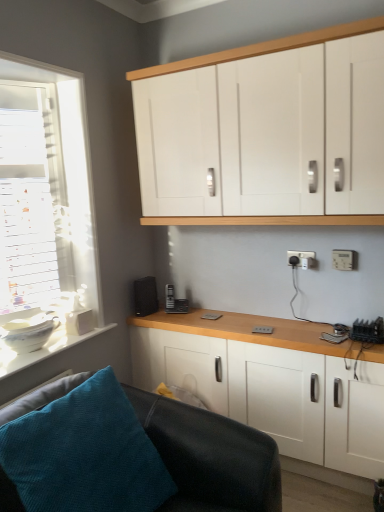
Question: Can you confirm if white glossy bowl at lower left is thinner than white matte cabinet at upper center, arranged as the 2th cabinetry when ordered from the bottom?

Choices:
 (A) yes
 (B) no

Answer: (B)

Question: Is white glossy bowl at lower left shorter than white matte cabinet at upper center, marked as the 1th cabinetry in a top-to-bottom arrangement?

Choices:
 (A) yes
 (B) no

Answer: (A)

Question: Considering the relative positions of white glossy bowl at lower left and white matte cabinet at upper center, marked as the 1th cabinetry in a top-to-bottom arrangement, in the image provided, is white glossy bowl at lower left to the left of white matte cabinet at upper center, marked as the 1th cabinetry in a top-to-bottom arrangement, from the viewer's perspective?

Choices:
 (A) no
 (B) yes

Answer: (B)

Question: From a real-world perspective, is white glossy bowl at lower left positioned over white matte cabinet at upper center, arranged as the 2th cabinetry when ordered from the bottom, based on gravity?

Choices:
 (A) no
 (B) yes

Answer: (A)

Question: Does white glossy bowl at lower left come behind white matte cabinet at upper center, marked as the 1th cabinetry in a top-to-bottom arrangement?

Choices:
 (A) yes
 (B) no

Answer: (A)

Question: Is white glossy bowl at lower left facing towards white matte cabinet at upper center, arranged as the 2th cabinetry when ordered from the bottom?

Choices:
 (A) yes
 (B) no

Answer: (B)

Question: Is the depth of white matte cabinet at lower center, acting as the first cabinetry starting from the bottom, less than that of white plastic electric outlet at lower right, marked as the first electric outlet in a front-to-back arrangement?

Choices:
 (A) no
 (B) yes

Answer: (B)

Question: Does white matte cabinet at lower center, acting as the first cabinetry starting from the bottom, have a greater width compared to white plastic electric outlet at lower right, the second electric outlet when ordered from back to front?

Choices:
 (A) no
 (B) yes

Answer: (B)

Question: Is white matte cabinet at lower center, acting as the first cabinetry starting from the bottom, smaller than white plastic electric outlet at lower right, the second electric outlet when ordered from back to front?

Choices:
 (A) yes
 (B) no

Answer: (B)

Question: From the image's perspective, does white matte cabinet at lower center, acting as the first cabinetry starting from the bottom, appear lower than white plastic electric outlet at lower right, the second electric outlet when ordered from back to front?

Choices:
 (A) yes
 (B) no

Answer: (A)

Question: Is the position of white matte cabinet at lower center, acting as the first cabinetry starting from the bottom, more distant than that of white plastic electric outlet at lower right, marked as the first electric outlet in a front-to-back arrangement?

Choices:
 (A) yes
 (B) no

Answer: (B)

Question: Is white plastic electric outlet at lower right, the second electric outlet from the left, surrounded by white matte cabinet at lower center, the 2th cabinetry viewed from the top?

Choices:
 (A) yes
 (B) no

Answer: (B)

Question: Does black matte speaker at lower left lie behind white matte cabinet at upper center, arranged as the 2th cabinetry when ordered from the bottom?

Choices:
 (A) yes
 (B) no

Answer: (A)